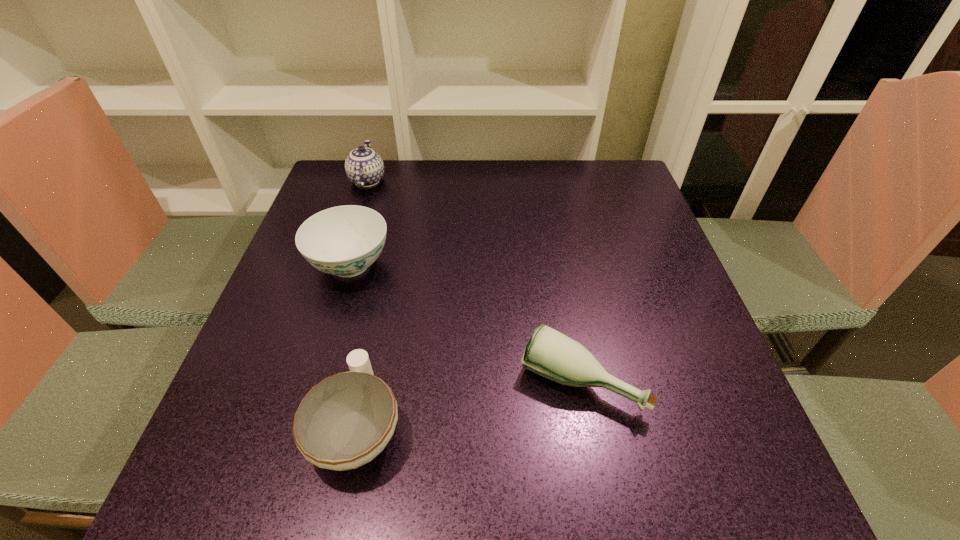
Locate which chinaware ranks second in proximity to the shortest chinaware. Please provide its 2D coordinates. Your answer should be formatted as a tuple, i.e. [(x, y)], where the tuple contains the x and y coordinates of a point satisfying the conditions above.

[(364, 167)]

Identify which chinaware is the nearest to the nearest chinaware. Please provide its 2D coordinates. Your answer should be formatted as a tuple, i.e. [(x, y)], where the tuple contains the x and y coordinates of a point satisfying the conditions above.

[(345, 240)]

Where is `vacant point that satisfies the following two spatial constraints: 1. on the side with the handle of the bottle; 2. on the right side of the nearest chinaware`? vacant point that satisfies the following two spatial constraints: 1. on the side with the handle of the bottle; 2. on the right side of the nearest chinaware is located at coordinates (368, 381).